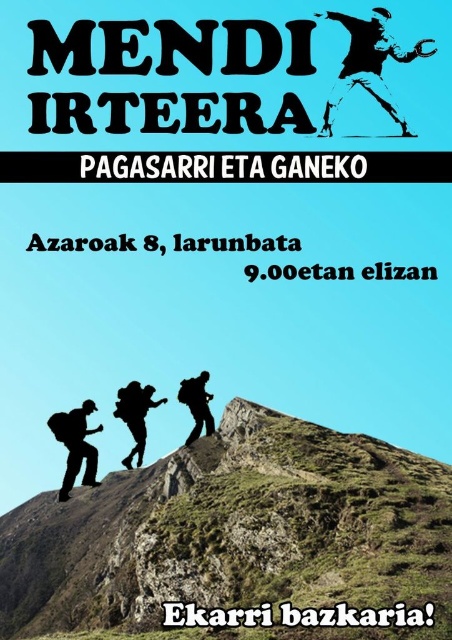
You are looking at the promotional poster for the MENDI IRTEERA event. The poster has a green grassy peak at center and a black silhouette at upper center. Which object is located higher up on the poster?

The black silhouette at upper center is located higher up on the poster than the green grassy peak at center.

You are planning to attend the MENDI IRTEERA event and see the promotional poster. You notice the green grassy peak at center and the black matte backpack at lower left. Based on the poster, which object is closer to the bottom of the image?

The black matte backpack at lower left is closer to the bottom of the image because it is positioned above the green grassy peak at center.

What is the spatial relationship between the black matte backpack at lower left and the green grassy peak at center in the poster?

The black matte backpack at lower left is behind the green grassy peak at center in the poster.